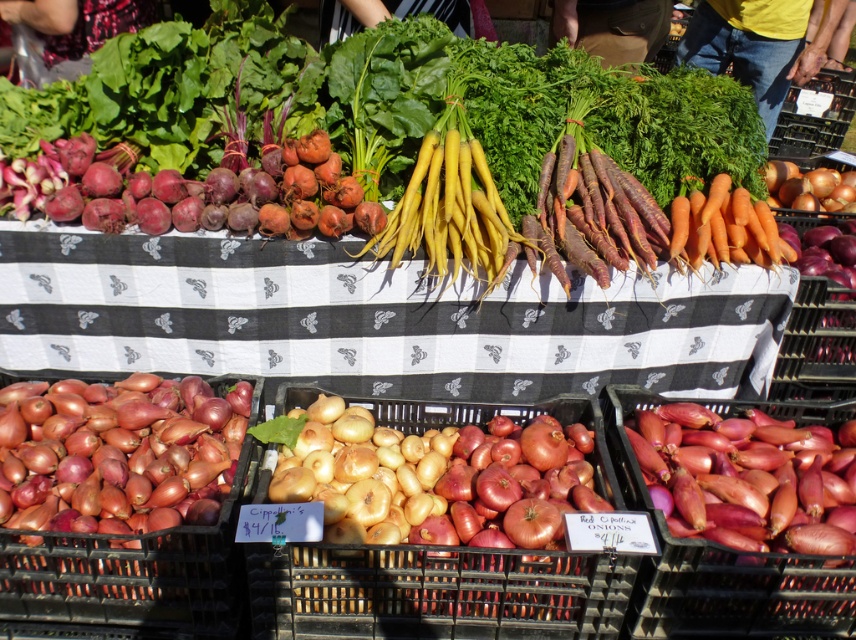
Question: Which point is closer to the camera taking this photo?

Choices:
 (A) (227, 220)
 (B) (774, 268)
 (C) (250, 451)

Answer: (C)

Question: Which point appears farthest from the camera in this image?

Choices:
 (A) (736, 236)
 (B) (207, 33)
 (C) (331, 173)

Answer: (B)

Question: Is shiny red onion at lower left to the left of orange matte carrots at upper right from the viewer's perspective?

Choices:
 (A) no
 (B) yes

Answer: (B)

Question: Based on their relative distances, which object is farther from the yellow wax beans at center?

Choices:
 (A) shiny red onion at lower left
 (B) orange matte carrots at upper right
 (C) purple matte beets at left

Answer: (A)

Question: Is shiny red onion at lower left further to camera compared to orange matte carrots at upper right?

Choices:
 (A) yes
 (B) no

Answer: (B)

Question: Can you confirm if purple matte beets at left is positioned above orange matte carrots at upper right?

Choices:
 (A) yes
 (B) no

Answer: (A)